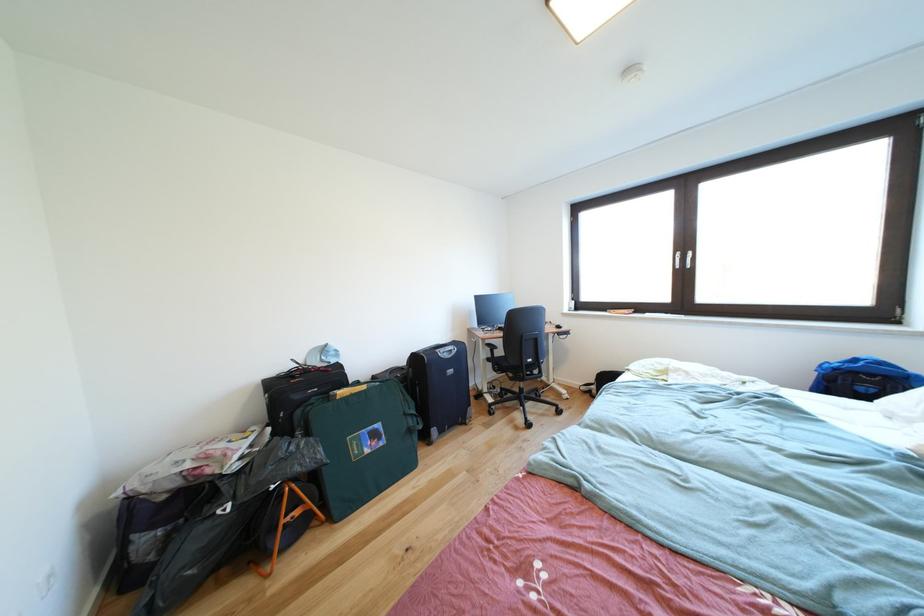
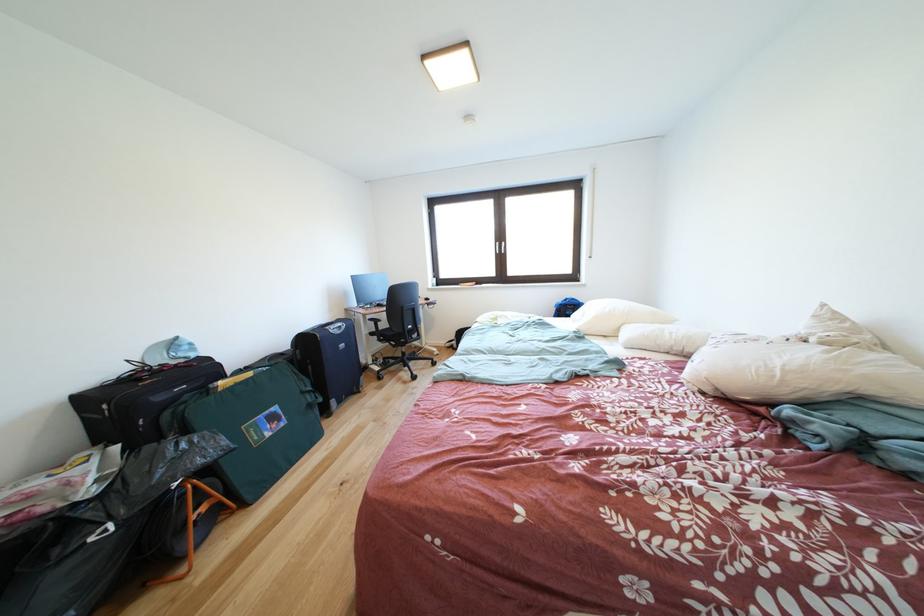
The point at (372, 392) is marked in the first image. Where is the corresponding point in the second image?

(259, 379)